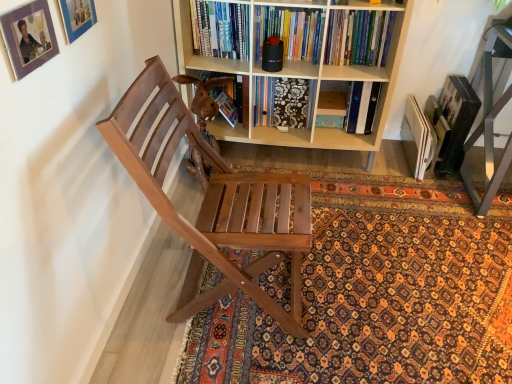
This screenshot has width=512, height=384. I want to click on free region under patterned carpet at center (from a real-world perspective), so click(x=403, y=274).